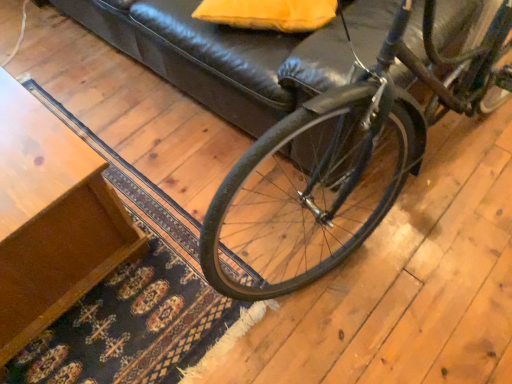
Question: Can you confirm if shiny black bicycle at center is bigger than wooden table at lower left?

Choices:
 (A) no
 (B) yes

Answer: (B)

Question: Does shiny black bicycle at center have a greater height compared to wooden table at lower left?

Choices:
 (A) no
 (B) yes

Answer: (B)

Question: Considering the relative positions of shiny black bicycle at center and wooden table at lower left in the image provided, is shiny black bicycle at center in front of wooden table at lower left?

Choices:
 (A) no
 (B) yes

Answer: (B)

Question: Is shiny black bicycle at center thinner than wooden table at lower left?

Choices:
 (A) no
 (B) yes

Answer: (A)

Question: Would you say shiny black bicycle at center is a long distance from wooden table at lower left?

Choices:
 (A) yes
 (B) no

Answer: (B)

Question: Is point (344, 115) positioned closer to the camera than point (224, 9)?

Choices:
 (A) closer
 (B) farther

Answer: (A)

Question: Relative to matte yellow pillow at upper center, is shiny black bicycle at center in front or behind?

Choices:
 (A) front
 (B) behind

Answer: (A)

Question: Is shiny black bicycle at center bigger or smaller than matte yellow pillow at upper center?

Choices:
 (A) small
 (B) big

Answer: (B)

Question: From a real-world perspective, is shiny black bicycle at center positioned above or below matte yellow pillow at upper center?

Choices:
 (A) below
 (B) above

Answer: (B)

Question: Does point (306, 26) appear closer or farther from the camera than point (308, 283)?

Choices:
 (A) closer
 (B) farther

Answer: (A)

Question: Looking at their shapes, would you say matte yellow pillow at upper center is wider or thinner than shiny black bicycle at center?

Choices:
 (A) wide
 (B) thin

Answer: (B)

Question: From a real-world perspective, relative to shiny black bicycle at center, is matte yellow pillow at upper center vertically above or below?

Choices:
 (A) below
 (B) above

Answer: (A)

Question: Visually, is matte yellow pillow at upper center positioned to the left or to the right of shiny black bicycle at center?

Choices:
 (A) right
 (B) left

Answer: (B)

Question: Looking at the image, does wooden table at lower left seem bigger or smaller compared to matte yellow pillow at upper center?

Choices:
 (A) big
 (B) small

Answer: (A)

Question: Considering their positions, is wooden table at lower left located in front of or behind matte yellow pillow at upper center?

Choices:
 (A) front
 (B) behind

Answer: (A)